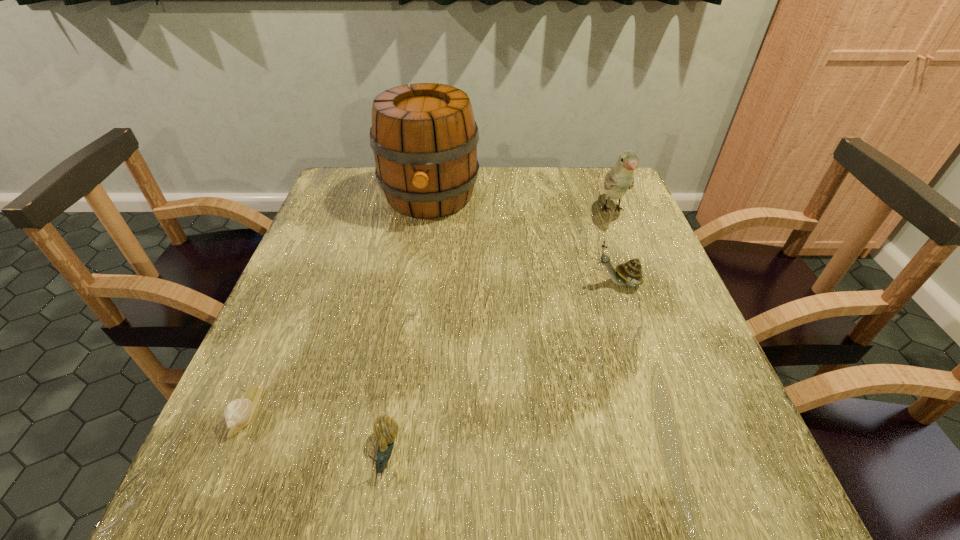
This screenshot has height=540, width=960. What are the coordinates of `the tallest object` in the screenshot? It's located at (424, 138).

This screenshot has height=540, width=960. I want to click on bird, so click(x=620, y=178).

Locate an element on the screen. the rightmost escargot is located at coordinates (630, 273).

Locate an element on the screen. Image resolution: width=960 pixels, height=540 pixels. the third nearest object is located at coordinates (630, 273).

Where is `the second escargot from left to right`? The height and width of the screenshot is (540, 960). the second escargot from left to right is located at coordinates (385, 429).

This screenshot has height=540, width=960. Find the location of `the shortest escargot`. the shortest escargot is located at coordinates (238, 413).

Identify the location of the shortest object. (238, 413).

The image size is (960, 540). Identify the location of vacant space positioned 0.320m on the side of the cider where the spigot is located. (411, 320).

You are a GUI agent. You are given a task and a screenshot of the screen. Output one action in this format:
    pyautogui.click(x=<x>, y=<y>)
    Task: Click on the vacant space situated at the face of the second tallest object
    The height and width of the screenshot is (540, 960).
    Given the screenshot: What is the action you would take?
    pyautogui.click(x=666, y=350)

This screenshot has height=540, width=960. What are the coordinates of `vacant space located 0.290m on the face of the third farthest object` in the screenshot? It's located at (466, 283).